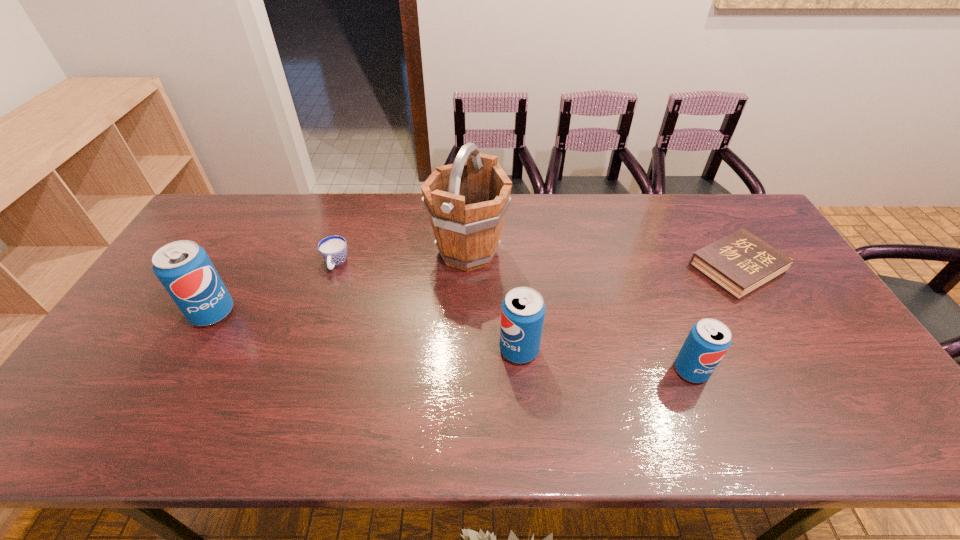
To achieve uniform spacing by inserting another pop_(soda) among them, please point to a free space for this new pop_(soda). Please provide its 2D coordinates. Your answer should be formatted as a tuple, i.e. [(x, y)], where the tuple contains the x and y coordinates of a point satisfying the conditions above.

[(360, 330)]